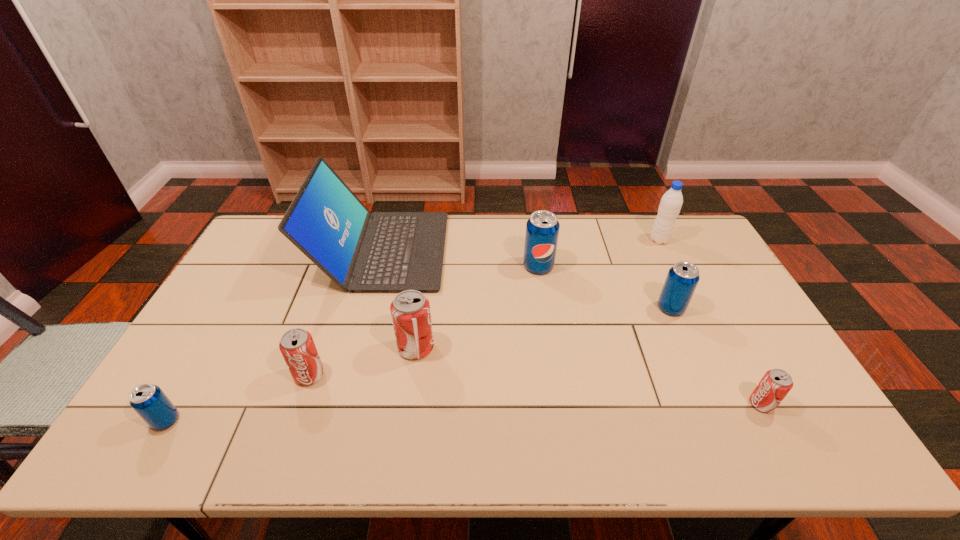
Locate an element on the screen. vacant area that lies between the leftmost pink soda can and the nearest blue pop soda is located at coordinates (237, 397).

Where is `vacant area that lies between the water bottle and the fourth nearest object`? This screenshot has width=960, height=540. vacant area that lies between the water bottle and the fourth nearest object is located at coordinates point(538,294).

Image resolution: width=960 pixels, height=540 pixels. What are the coordinates of `free spot between the second smallest blue pop soda and the smallest pink soda can` in the screenshot? It's located at (716, 356).

At what (x,y) coordinates should I click in order to perform the action: click on free point between the rightmost blue pop soda and the leftmost object. Please return your answer as a coordinate pair (x, y). This screenshot has height=540, width=960. Looking at the image, I should click on [x=419, y=364].

What are the coordinates of `object that is the seventh closest to the biggest blue pop soda` in the screenshot? It's located at (148, 400).

Image resolution: width=960 pixels, height=540 pixels. Identify the location of object that ranks as the sixth closest to the second smallest blue pop soda. (297, 346).

At what (x,y) coordinates should I click in order to perform the action: click on soda can that is the fifth closest to the rightmost blue pop soda. Please return your answer as a coordinate pair (x, y). This screenshot has width=960, height=540. Looking at the image, I should click on (148, 400).

You are a GUI agent. You are given a task and a screenshot of the screen. Output one action in this format:
    pyautogui.click(x=<x>, y=<y>)
    Task: Click on the soda can that stands as the second closest to the rightmost blue pop soda
    The height and width of the screenshot is (540, 960).
    Given the screenshot: What is the action you would take?
    pyautogui.click(x=542, y=229)

Select which blue pop soda appears as the closest to the water bottle. Please provide its 2D coordinates. Your answer should be formatted as a tuple, i.e. [(x, y)], where the tuple contains the x and y coordinates of a point satisfying the conditions above.

[(682, 279)]

The height and width of the screenshot is (540, 960). Identify the location of blue pop soda that stands as the second closest to the fifth soda can from right to left. (542, 229).